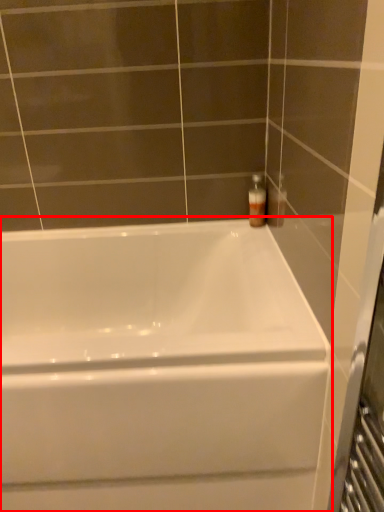
Question: From the image, what is the correct spatial relationship of bathtub (annotated by the red box) in relation to soap dispenser?

Choices:
 (A) left
 (B) right

Answer: (A)